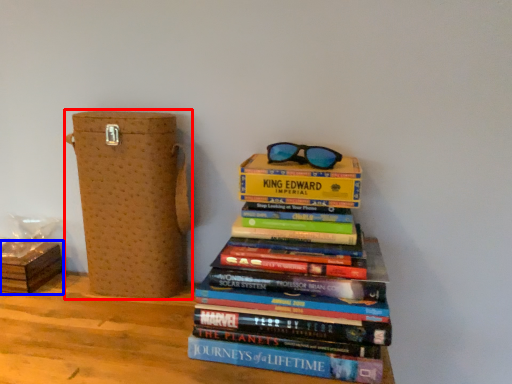
Question: Which object appears closest to the camera in this image, cardboard box (highlighted by a red box) or cardboard box (highlighted by a blue box)?

Choices:
 (A) cardboard box
 (B) cardboard box

Answer: (A)